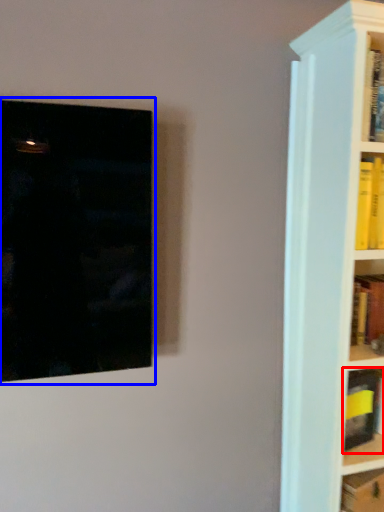
Question: Which object is further to the camera taking this photo, book (highlighted by a red box) or picture frame (highlighted by a blue box)?

Choices:
 (A) book
 (B) picture frame

Answer: (A)